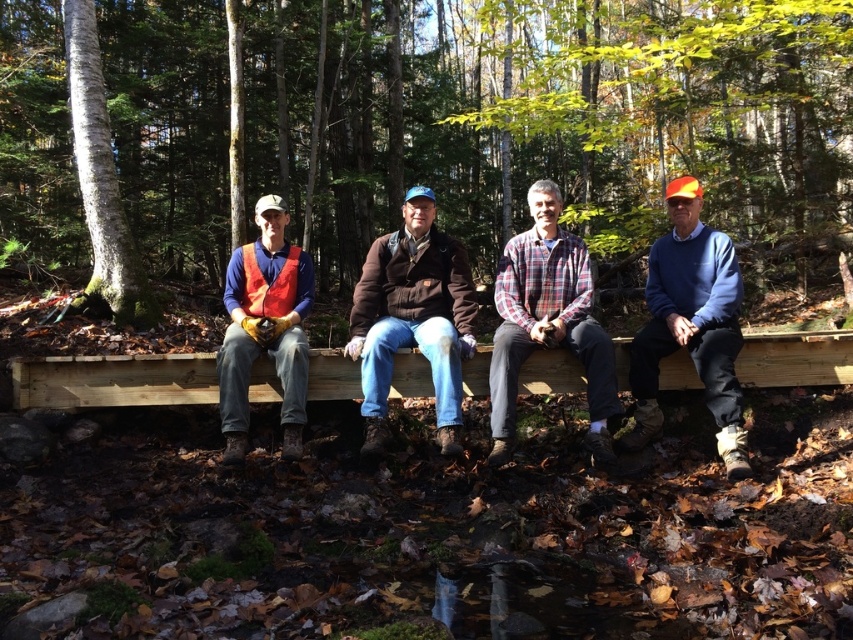
Question: Can you confirm if light brown wood bench at center is thinner than brown leather jacket at center?

Choices:
 (A) no
 (B) yes

Answer: (A)

Question: Is brown wooden bench at center wider than matte orange vest at left?

Choices:
 (A) yes
 (B) no

Answer: (A)

Question: Which of the following is the closest to the observer?

Choices:
 (A) matte black jacket at center
 (B) plaid flannel shirt at center

Answer: (A)

Question: Which point appears farthest from the camera in this image?

Choices:
 (A) (393, 234)
 (B) (444, 136)
 (C) (552, 188)

Answer: (B)

Question: Which point is closer to the camera?

Choices:
 (A) plaid flannel shirt at center
 (B) matte orange vest at left
 (C) matte black jacket at center
 (D) light brown wood bench at center

Answer: (C)

Question: Does brown wooden bench at center have a larger size compared to blue sweater at right?

Choices:
 (A) yes
 (B) no

Answer: (A)